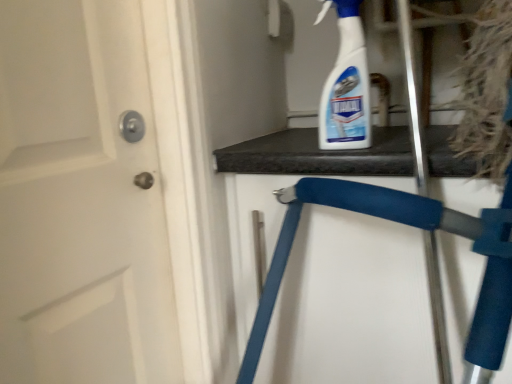
Image resolution: width=512 pixels, height=384 pixels. I want to click on white plastic spray bottle at upper right, so click(346, 85).

Image resolution: width=512 pixels, height=384 pixels. What do you see at coordinates (346, 85) in the screenshot?
I see `white plastic spray bottle at upper right` at bounding box center [346, 85].

The height and width of the screenshot is (384, 512). I want to click on blue foam folding chair at upper center, so click(413, 226).

This screenshot has width=512, height=384. What do you see at coordinates (413, 226) in the screenshot?
I see `blue foam folding chair at upper center` at bounding box center [413, 226].

Identify the location of white plastic spray bottle at upper right. (346, 85).

Between white plastic spray bottle at upper right and blue foam folding chair at upper center, which one appears on the left side from the viewer's perspective?

white plastic spray bottle at upper right.

Which object is further away from the camera taking this photo, white plastic spray bottle at upper right or blue foam folding chair at upper center?

white plastic spray bottle at upper right.

Considering the positions of point (342, 50) and point (266, 329), is point (342, 50) closer or farther from the camera than point (266, 329)?

Clearly, point (342, 50) is closer to the camera than point (266, 329).

From the image's perspective, which object appears higher, white plastic spray bottle at upper right or blue foam folding chair at upper center?

white plastic spray bottle at upper right, from the image's perspective.

From a real-world perspective, is white plastic spray bottle at upper right on blue foam folding chair at upper center?

Yes, from a real-world perspective, white plastic spray bottle at upper right is on top of blue foam folding chair at upper center.

Between white plastic spray bottle at upper right and blue foam folding chair at upper center, which one has larger width?

blue foam folding chair at upper center is wider.

Is white plastic spray bottle at upper right taller or shorter than blue foam folding chair at upper center?

Clearly, white plastic spray bottle at upper right is shorter compared to blue foam folding chair at upper center.

Is white plastic spray bottle at upper right smaller than blue foam folding chair at upper center?

Indeed, white plastic spray bottle at upper right has a smaller size compared to blue foam folding chair at upper center.

Is blue foam folding chair at upper center inside white plastic spray bottle at upper right?

No.

Is the surface of white plastic spray bottle at upper right in direct contact with blue foam folding chair at upper center?

No, white plastic spray bottle at upper right is not beside blue foam folding chair at upper center.

Is white plastic spray bottle at upper right oriented away from blue foam folding chair at upper center?

No, white plastic spray bottle at upper right is not facing the opposite direction of blue foam folding chair at upper center.

How distant is white plastic spray bottle at upper right from blue foam folding chair at upper center?

white plastic spray bottle at upper right is 9.58 inches away from blue foam folding chair at upper center.

Identify the location of folding chair below the white plastic spray bottle at upper right (from a real-world perspective). (413, 226).

Is blue foam folding chair at upper center at the right side of white plastic spray bottle at upper right?

Yes, blue foam folding chair at upper center is to the right of white plastic spray bottle at upper right.

Is blue foam folding chair at upper center further to the viewer compared to white plastic spray bottle at upper right?

No, blue foam folding chair at upper center is in front of white plastic spray bottle at upper right.

Considering the points (390, 195) and (334, 116), which point is behind, point (390, 195) or point (334, 116)?

The point (334, 116) is behind.

From the image's perspective, is blue foam folding chair at upper center positioned above or below white plastic spray bottle at upper right?

Based on their image positions, blue foam folding chair at upper center is located beneath white plastic spray bottle at upper right.

From a real-world perspective, is blue foam folding chair at upper center positioned above or below white plastic spray bottle at upper right?

Clearly, from a real-world perspective, blue foam folding chair at upper center is below white plastic spray bottle at upper right.

Which of these two, blue foam folding chair at upper center or white plastic spray bottle at upper right, is wider?

blue foam folding chair at upper center is wider.

Considering the relative sizes of blue foam folding chair at upper center and white plastic spray bottle at upper right in the image provided, is blue foam folding chair at upper center taller than white plastic spray bottle at upper right?

Yes.

Between blue foam folding chair at upper center and white plastic spray bottle at upper right, which one has smaller size?

white plastic spray bottle at upper right is smaller.

Is white plastic spray bottle at upper right a part of blue foam folding chair at upper center?

No, white plastic spray bottle at upper right is not surrounded by blue foam folding chair at upper center.

Is blue foam folding chair at upper center not near white plastic spray bottle at upper right?

No, blue foam folding chair at upper center is in close proximity to white plastic spray bottle at upper right.

Is white plastic spray bottle at upper right at the back of blue foam folding chair at upper center?

blue foam folding chair at upper center is not turned away from white plastic spray bottle at upper right.

How many degrees apart are the facing directions of blue foam folding chair at upper center and white plastic spray bottle at upper right?

The angle between the facing direction of blue foam folding chair at upper center and the facing direction of white plastic spray bottle at upper right is 13.9 degrees.

In the image, there is a blue foam folding chair at upper center. Where is `cleaning product above it (from the image's perspective)`? The height and width of the screenshot is (384, 512). cleaning product above it (from the image's perspective) is located at coordinates (346, 85).

You are a GUI agent. You are given a task and a screenshot of the screen. Output one action in this format:
    pyautogui.click(x=<x>, y=<y>)
    Task: Click on the cleaning product located above the blue foam folding chair at upper center (from a real-world perspective)
    The image size is (512, 384).
    Given the screenshot: What is the action you would take?
    pyautogui.click(x=346, y=85)

Find the location of a particular element. cleaning product above the blue foam folding chair at upper center (from the image's perspective) is located at coordinates (346, 85).